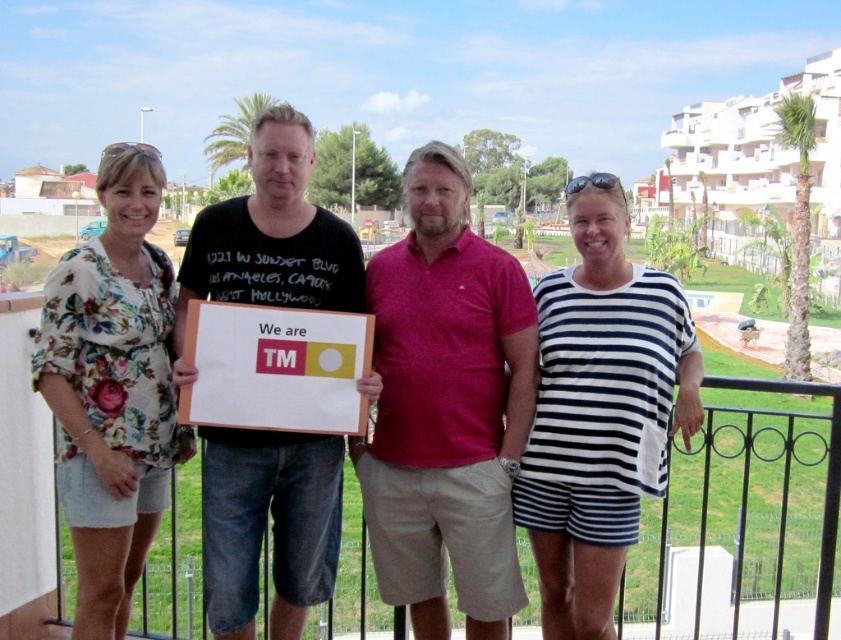
You are standing on the balcony and want to reach the point at coordinates point (164, 406). If your maximum reach is 15 feet, can you touch it without moving closer?

The point (164, 406) is 17.00 feet away from the camera, which is beyond your maximum reach of 15 feet. You cannot touch it without moving closer.